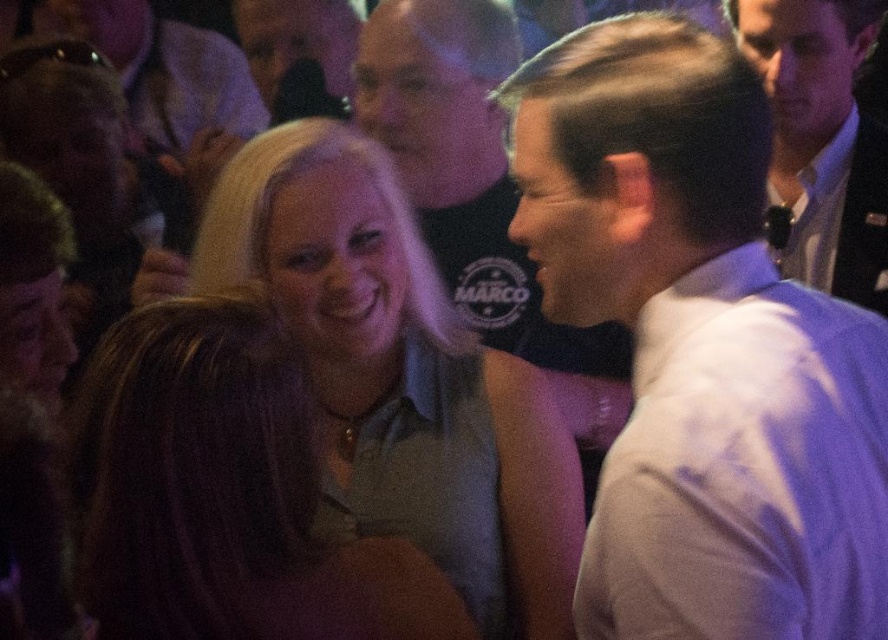
Question: Which object is the closest to the smooth white shirt at center?

Choices:
 (A) white shirt at right
 (B) matte gray shirt at center
 (C) light gray sleeveless top at center
 (D) white shirt at center

Answer: (C)

Question: Which is farther from the light gray sleeveless top at center?

Choices:
 (A) smooth white shirt at center
 (B) white shirt at center
 (C) white shirt at right
 (D) matte gray shirt at center

Answer: (C)

Question: Which of these objects is positioned farthest from the smooth white shirt at center?

Choices:
 (A) white shirt at right
 (B) white shirt at center
 (C) light gray sleeveless top at center
 (D) matte gray shirt at center

Answer: (B)

Question: Does white shirt at center have a smaller size compared to light gray sleeveless top at center?

Choices:
 (A) no
 (B) yes

Answer: (B)

Question: Is white shirt at center thinner than white shirt at right?

Choices:
 (A) yes
 (B) no

Answer: (B)

Question: Can you confirm if white shirt at center is smaller than smooth white shirt at center?

Choices:
 (A) yes
 (B) no

Answer: (A)